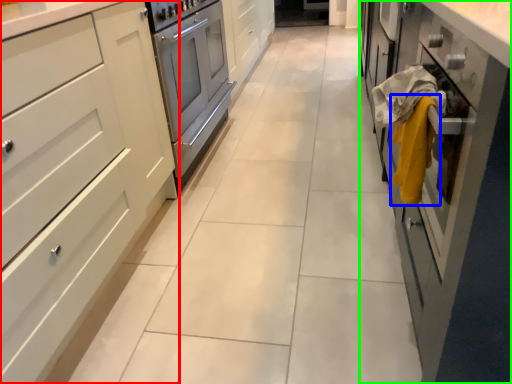
Question: Which object is positioned farthest from cabinetry (highlighted by a red box)? Select from blanket (highlighted by a blue box) and cabinetry (highlighted by a green box).

Choices:
 (A) blanket
 (B) cabinetry

Answer: (B)